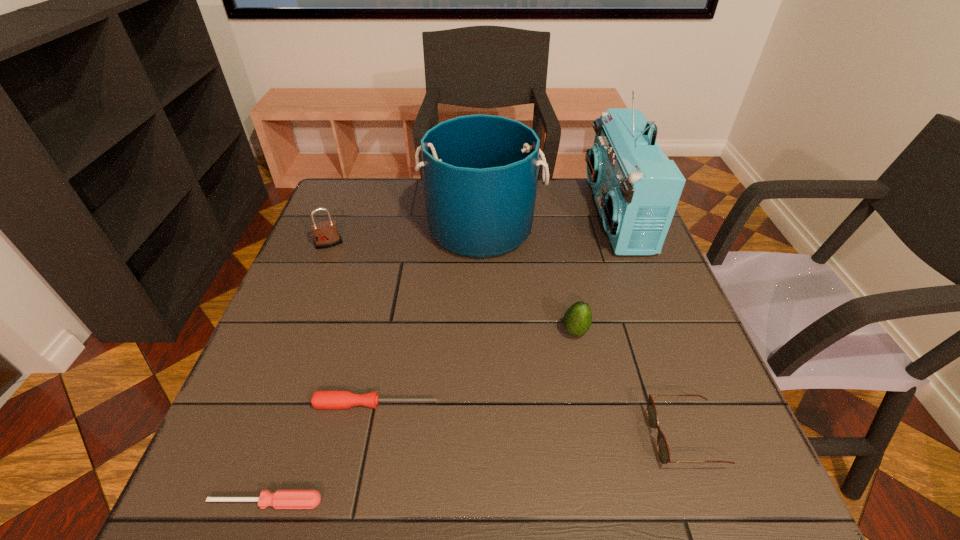
Locate an element on the screen. This screenshot has height=540, width=960. bucket that is at the far edge is located at coordinates (480, 172).

This screenshot has width=960, height=540. What are the coordinates of `spectacles that is positioned at the near edge` in the screenshot? It's located at (663, 450).

Find the location of a particular element. This screenshot has height=540, width=960. screwdriver that is at the near edge is located at coordinates (282, 499).

Find the location of a particular element. Image resolution: width=960 pixels, height=540 pixels. padlock that is positioned at the left edge is located at coordinates (325, 233).

Identify the location of radio receiver that is at the right edge. (637, 188).

Identify the location of spectacles that is positioned at the right edge. The width and height of the screenshot is (960, 540). (663, 450).

In order to click on object located in the near left corner section of the desktop in this screenshot , I will do `click(282, 499)`.

Where is `object that is at the far right corner`? object that is at the far right corner is located at coordinates coord(637,188).

At what (x,y) coordinates should I click in order to perform the action: click on object that is at the near right corner. Please return your answer as a coordinate pair (x, y). Image resolution: width=960 pixels, height=540 pixels. Looking at the image, I should click on (663, 450).

This screenshot has width=960, height=540. Find the location of `free space at the far edge`. free space at the far edge is located at coordinates (389, 206).